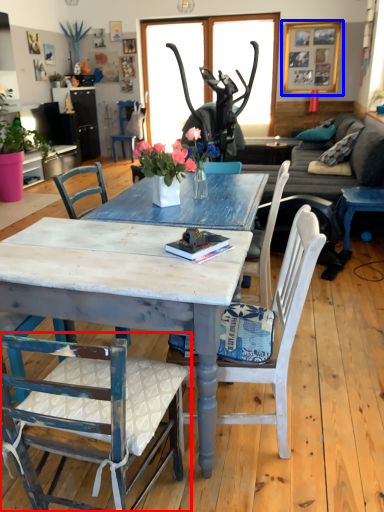
Question: Which object appears farthest to the camera in this image, chair (highlighted by a red box) or picture frame (highlighted by a blue box)?

Choices:
 (A) chair
 (B) picture frame

Answer: (B)